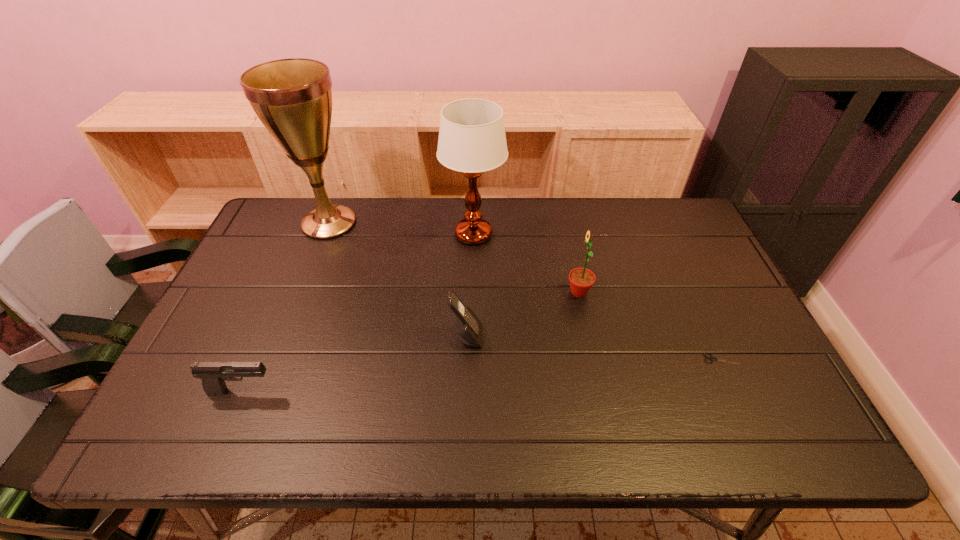
Find the location of a particular element. The width and height of the screenshot is (960, 540). free space between the nearest object and the fifth farthest object is located at coordinates (482, 375).

The height and width of the screenshot is (540, 960). I want to click on free spot between the fifth tallest object and the shears, so click(482, 375).

The image size is (960, 540). Identify the location of free spot between the trophy cup and the rightmost object. (525, 291).

Locate an element on the screen. vacant point located between the sunflower and the fifth tallest object is located at coordinates (411, 341).

The image size is (960, 540). I want to click on unoccupied position between the third tallest object and the table lamp, so click(x=526, y=264).

In order to click on vacant point located between the shortest object and the fourth farthest object in this screenshot , I will do `click(593, 348)`.

This screenshot has height=540, width=960. What are the coordinates of `vacant region between the pistol and the third nearest object` in the screenshot? It's located at (354, 363).

Find the location of a particular element. vacant area between the fifth tallest object and the table lamp is located at coordinates (358, 313).

Image resolution: width=960 pixels, height=540 pixels. I want to click on free area in between the tallest object and the table lamp, so click(x=401, y=228).

Identify the location of object that is the fifth closest to the table lamp. This screenshot has width=960, height=540. (711, 358).